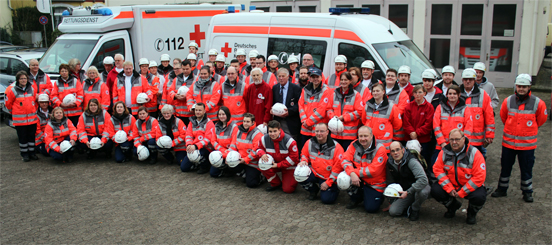
Where is `door`? The width and height of the screenshot is (552, 245). door is located at coordinates (504, 57).